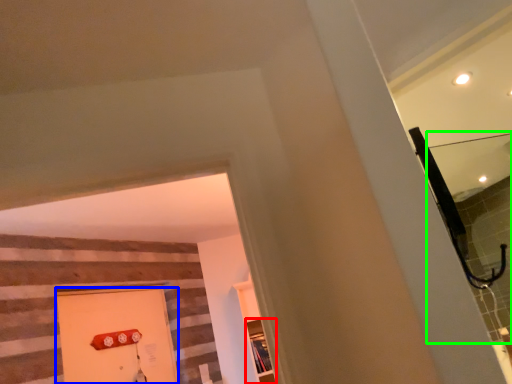
Question: Based on their relative distances, which object is farther from shelf (highlighted by a red box)? Choose from door (highlighted by a blue box) and mirror (highlighted by a green box).

Choices:
 (A) door
 (B) mirror

Answer: (B)